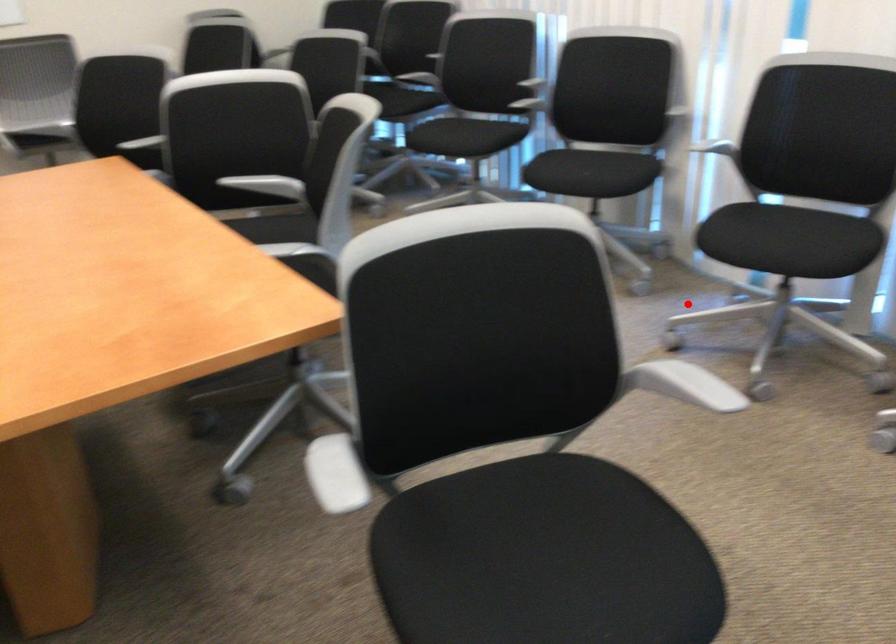
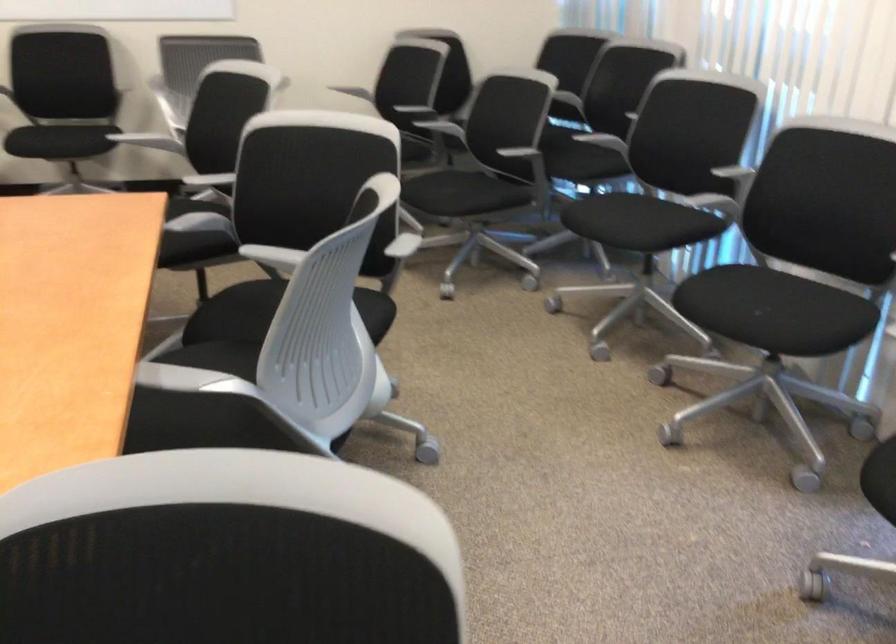
Where in the second image is the point corresponding to the highlighted location from the first image?

(858, 527)